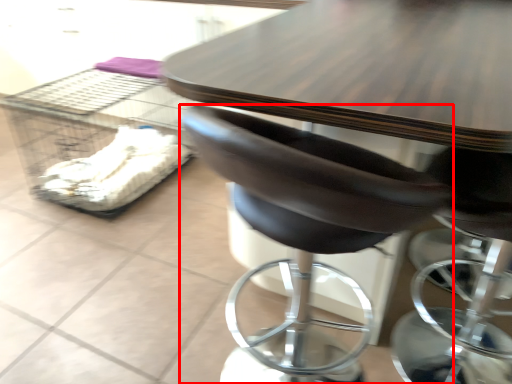
Question: From the image's perspective, where is chair (annotated by the red box) located relative to crate?

Choices:
 (A) below
 (B) above

Answer: (A)